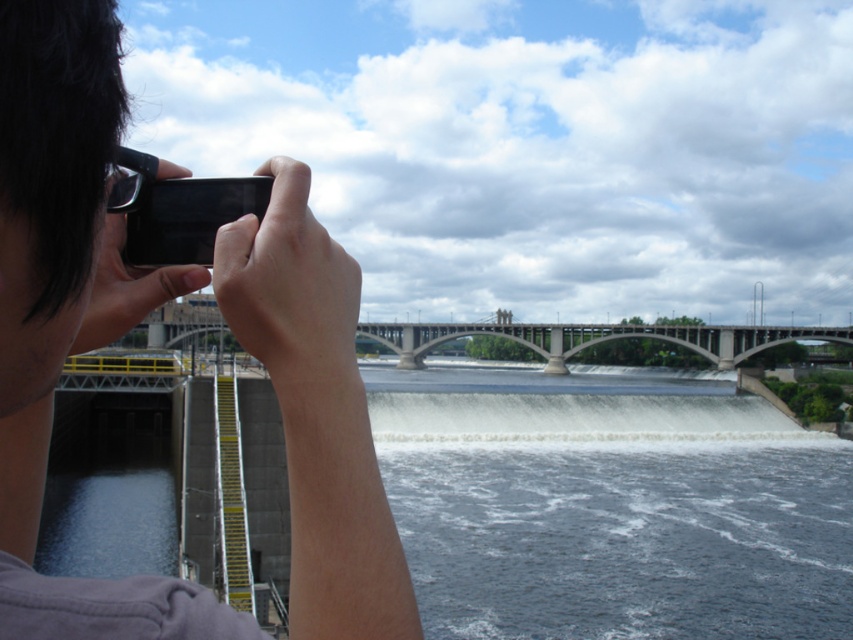
Who is taller, concrete bridge at center or black matte smartphone at upper left?

With more height is concrete bridge at center.

Can you confirm if concrete bridge at center is positioned to the right of black matte smartphone at upper left?

Correct, you'll find concrete bridge at center to the right of black matte smartphone at upper left.

Is point (730, 362) farther from camera compared to point (157, 240)?

Yes, point (730, 362) is behind point (157, 240).

Find the location of a particular element. concrete bridge at center is located at coordinates (596, 339).

Can you confirm if matte black phone at upper left is thinner than concrete bridge at center?

Yes, matte black phone at upper left is thinner than concrete bridge at center.

Where is `matte black phone at upper left`? The image size is (853, 640). matte black phone at upper left is located at coordinates (68, 307).

Find the location of a particular element. matte black phone at upper left is located at coordinates (68, 307).

Between matte black phone at upper left and black matte smartphone at upper left, which one has less height?

With less height is black matte smartphone at upper left.

Who is taller, matte black phone at upper left or black matte smartphone at upper left?

Standing taller between the two is matte black phone at upper left.

Who is more forward, (67, 228) or (155, 218)?

Point (67, 228) is more forward.

Image resolution: width=853 pixels, height=640 pixels. I want to click on matte black phone at upper left, so click(68, 307).